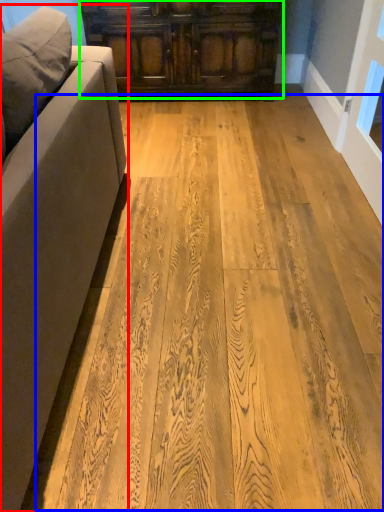
Question: Which object is positioned closest to studio couch (highlighted by a red box)? Select from plywood (highlighted by a blue box) and cabinetry (highlighted by a green box).

Choices:
 (A) plywood
 (B) cabinetry

Answer: (A)